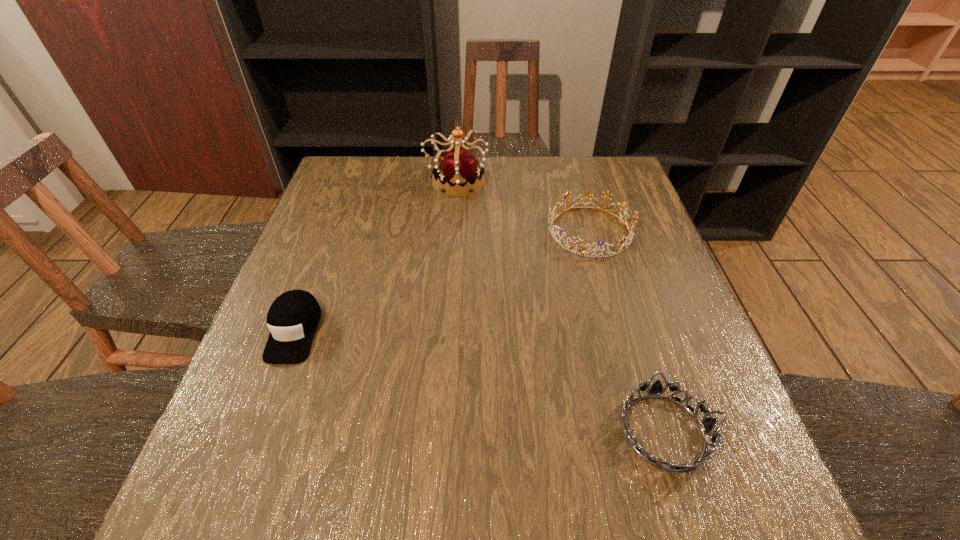
Find the location of a particular element. the leftmost tiara is located at coordinates click(x=459, y=169).

Where is `the farthest tiara`? The width and height of the screenshot is (960, 540). the farthest tiara is located at coordinates (459, 169).

Find the location of a particular element. The width and height of the screenshot is (960, 540). the second farthest object is located at coordinates (624, 242).

At what (x,y) coordinates should I click in order to perform the action: click on the second nearest tiara. Please return your answer as a coordinate pair (x, y). This screenshot has height=540, width=960. Looking at the image, I should click on (624, 242).

Identify the location of the third farthest object. The height and width of the screenshot is (540, 960). (293, 318).

What are the coordinates of `the leftmost object` in the screenshot? It's located at (293, 318).

Identify the location of the nearest tiara. (706, 425).

Locate an element on the screen. Image resolution: width=960 pixels, height=540 pixels. the nearest object is located at coordinates (706, 425).

Locate an element on the screen. The height and width of the screenshot is (540, 960). blank space located on the front-facing side of the leftmost tiara is located at coordinates (611, 181).

You are a GUI agent. You are given a task and a screenshot of the screen. Output one action in this format:
    pyautogui.click(x=<x>, y=<y>)
    Task: Click on the vacant space located on the front-facing side of the second farthest tiara
    The image size is (960, 540).
    Given the screenshot: What is the action you would take?
    pyautogui.click(x=396, y=231)